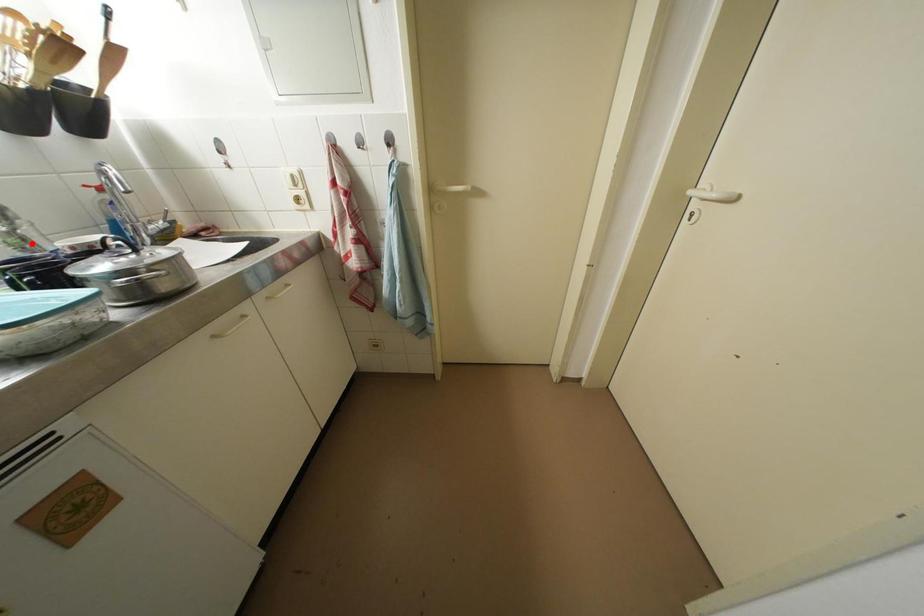
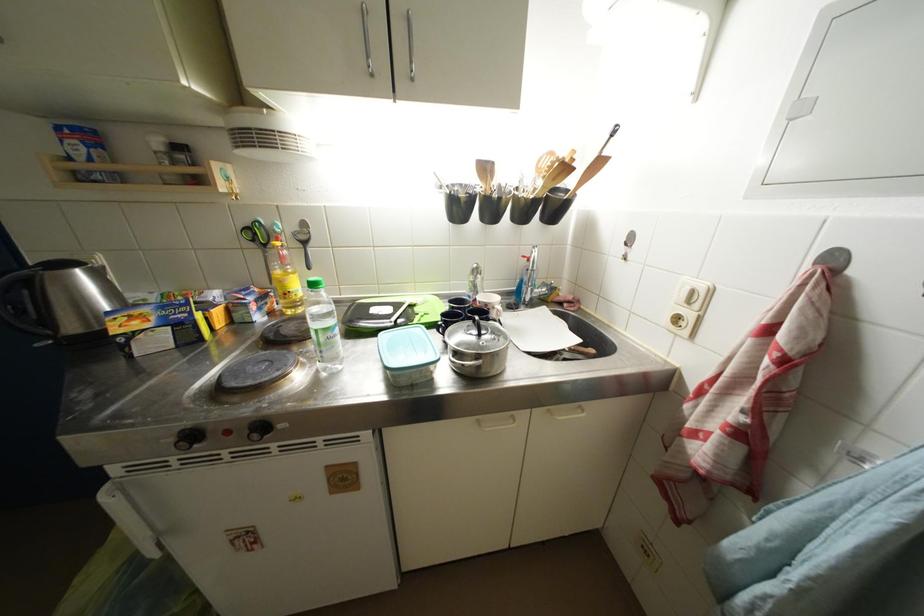
Find the pixel in the second image that matches the highlighted location in the first image.

(481, 291)